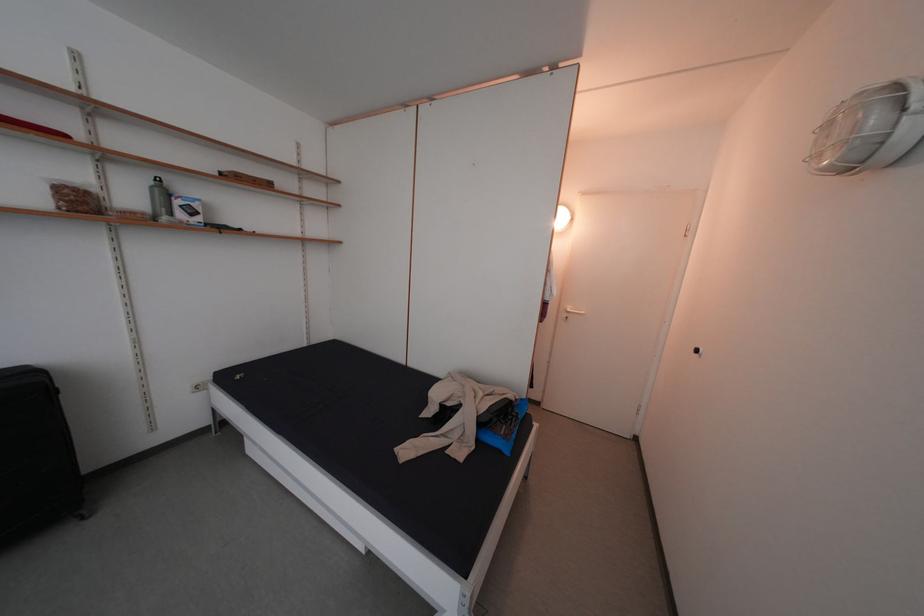
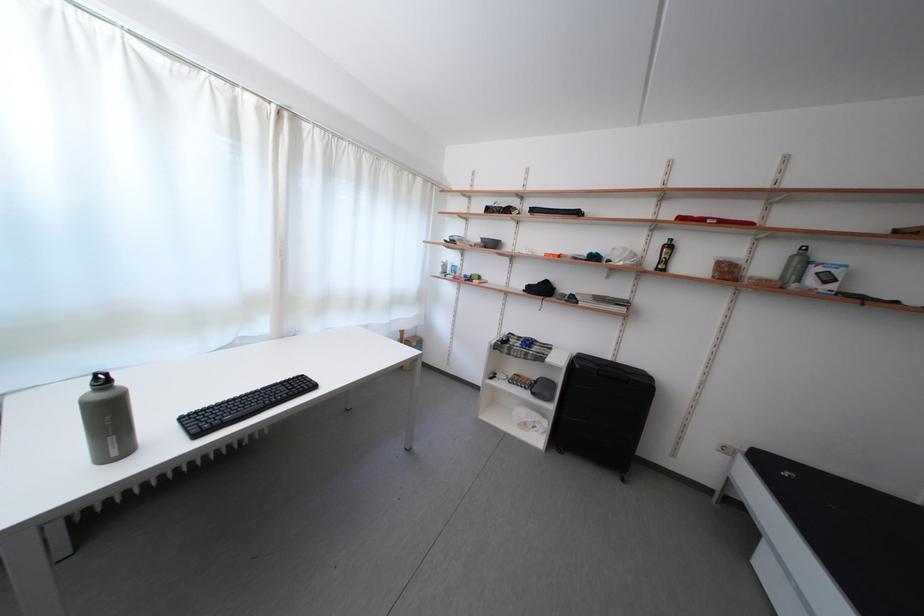
The point at (161,188) is marked in the first image. Where is the corresponding point in the second image?

(804, 257)